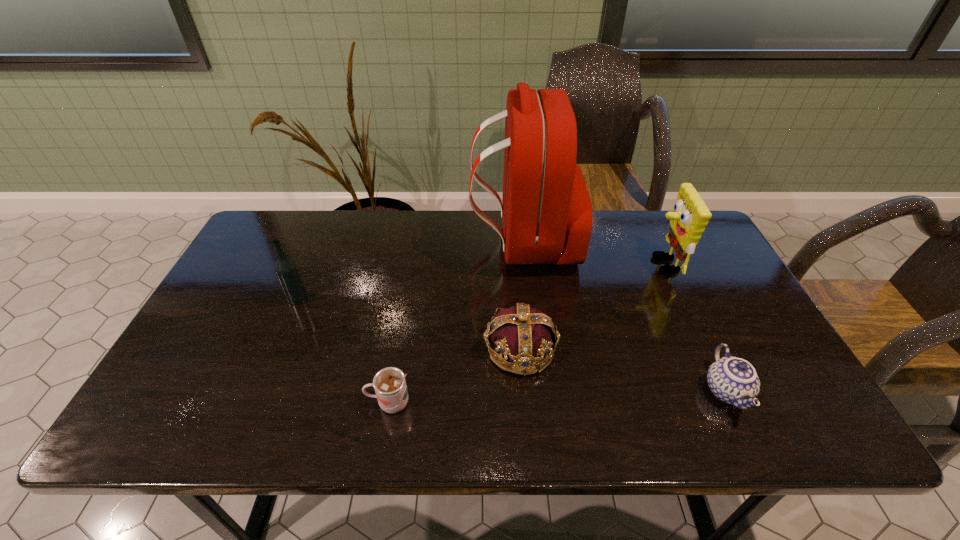
In order to click on the tallest object in this screenshot , I will do `click(547, 214)`.

Image resolution: width=960 pixels, height=540 pixels. Identify the location of sponge. (690, 217).

Locate an element on the screen. the third tallest object is located at coordinates (286, 269).

The width and height of the screenshot is (960, 540). Find the location of `the fourth nearest object`. the fourth nearest object is located at coordinates (286, 269).

Image resolution: width=960 pixels, height=540 pixels. I want to click on the fourth tallest object, so click(527, 337).

This screenshot has height=540, width=960. What are the coordinates of `cup` in the screenshot? It's located at (389, 383).

Find the location of `chinaware`. chinaware is located at coordinates (733, 380).

Identify the location of free point located 0.060m on the strap side of the backpack. (452, 242).

Where is `blank space located on the strap side of the backpack`? blank space located on the strap side of the backpack is located at coordinates (389, 242).

I want to click on vacant space situated on the strap side of the backpack, so click(x=445, y=242).